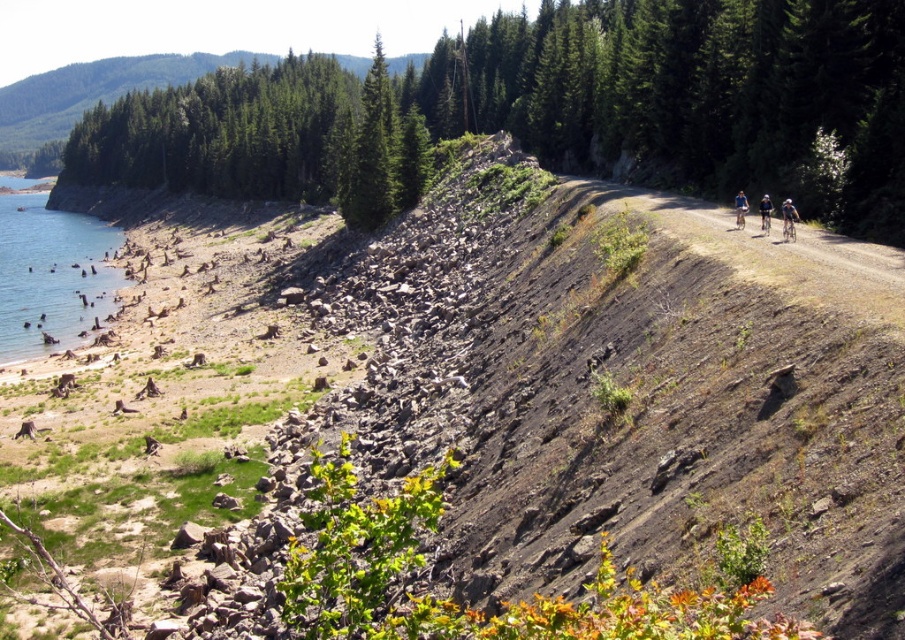
You are standing at the center of the dirt path in the middle ground. Looking towards the lower left corner of the scene, can you see the clear blue water at lower left? If yes, where exactly is it positioned relative to your current location?

Yes, the clear blue water at lower left is positioned at the coordinates point (50, 273) relative to your current location on the dirt path in the middle ground.

You are standing at the point marked as point (789, 228) and want to walk to the point marked as point (763, 214). Which direction should you face to walk directly towards your destination?

You should face towards the upper left direction to walk directly from point (789, 228) to point (763, 214).